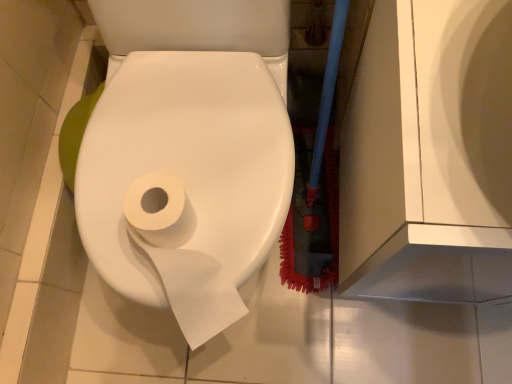
Question: Considering the positions of white matte toilet paper at center, acting as the second toilet paper starting from the front, and white matte toilet paper at center, which appears as the first toilet paper when viewed from the front, in the image, is white matte toilet paper at center, acting as the second toilet paper starting from the front, wider or thinner than white matte toilet paper at center, which appears as the first toilet paper when viewed from the front,?

Choices:
 (A) thin
 (B) wide

Answer: (A)

Question: From the image's perspective, is white matte toilet paper at center, acting as the second toilet paper starting from the front, above or below white matte toilet paper at center, which appears as the first toilet paper when viewed from the front?

Choices:
 (A) below
 (B) above

Answer: (A)

Question: In terms of height, does white matte toilet paper at center, acting as the second toilet paper starting from the front, look taller or shorter compared to white matte toilet paper at center, which is the second toilet paper from back to front?

Choices:
 (A) tall
 (B) short

Answer: (B)

Question: Considering the positions of white matte toilet paper at center, which is the second toilet paper from back to front, and white matte toilet paper at center, acting as the first toilet paper starting from the back, in the image, is white matte toilet paper at center, which is the second toilet paper from back to front, bigger or smaller than white matte toilet paper at center, acting as the first toilet paper starting from the back,?

Choices:
 (A) big
 (B) small

Answer: (A)

Question: Is white matte toilet paper at center, which is the second toilet paper from back to front, wider or thinner than white matte toilet paper at center, acting as the second toilet paper starting from the front?

Choices:
 (A) thin
 (B) wide

Answer: (B)

Question: Is white matte toilet paper at center, which is the second toilet paper from back to front, to the left or to the right of white matte toilet paper at center, acting as the first toilet paper starting from the back, in the image?

Choices:
 (A) left
 (B) right

Answer: (B)

Question: Is point (167, 107) closer or farther from the camera than point (202, 334)?

Choices:
 (A) farther
 (B) closer

Answer: (A)